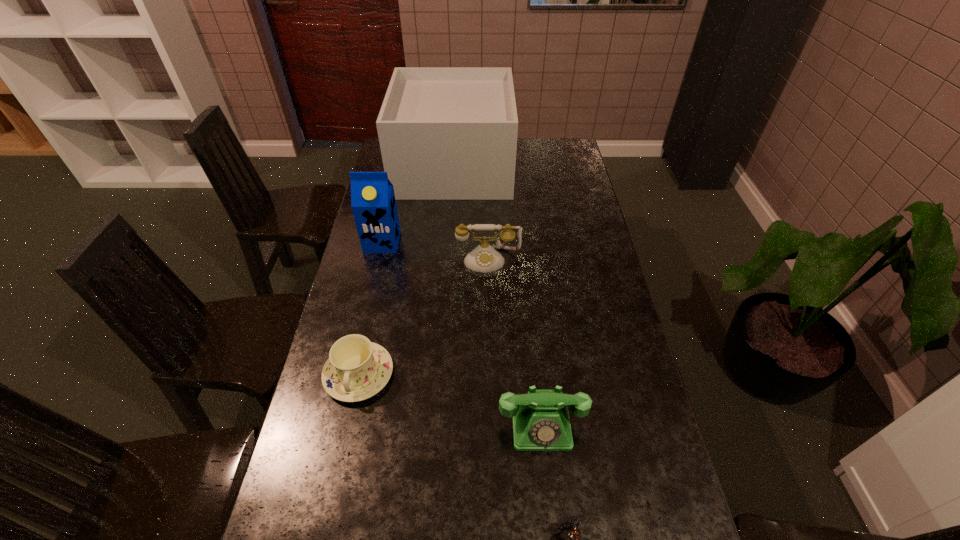
Image resolution: width=960 pixels, height=540 pixels. In order to click on vacant space that's between the second nearest telephone and the chinaware in this screenshot , I will do `click(450, 399)`.

This screenshot has height=540, width=960. Find the location of `vacant area that lies between the second nearest telephone and the farthest telephone`. vacant area that lies between the second nearest telephone and the farthest telephone is located at coordinates (515, 342).

At what (x,y) coordinates should I click in order to perform the action: click on empty location between the carton and the box. Please return your answer as a coordinate pair (x, y). The height and width of the screenshot is (540, 960). Looking at the image, I should click on (418, 204).

You are a GUI agent. You are given a task and a screenshot of the screen. Output one action in this format:
    pyautogui.click(x=<x>, y=<y>)
    Task: Click on the free spot between the farthest object and the carton
    The image size is (960, 540).
    Given the screenshot: What is the action you would take?
    pyautogui.click(x=418, y=204)

Identify which object is the fifth closest to the carton. Please provide its 2D coordinates. Your answer should be formatted as a tuple, i.e. [(x, y)], where the tuple contains the x and y coordinates of a point satisfying the conditions above.

[(574, 535)]

Point out which object is positioned as the fourth nearest to the second nearest telephone. Please provide its 2D coordinates. Your answer should be formatted as a tuple, i.e. [(x, y)], where the tuple contains the x and y coordinates of a point satisfying the conditions above.

[(373, 203)]

Select which telephone appears as the closest to the nearest object. Please provide its 2D coordinates. Your answer should be formatted as a tuple, i.e. [(x, y)], where the tuple contains the x and y coordinates of a point satisfying the conditions above.

[(541, 422)]

Locate an element on the screen. The width and height of the screenshot is (960, 540). telephone identified as the closest to the nearest object is located at coordinates (541, 422).

Locate an element on the screen. blank area in the image that satisfies the following two spatial constraints: 1. on the side of the farthest object with the window; 2. with the cap open on the carton is located at coordinates (448, 242).

Locate an element on the screen. vacant space that satisfies the following two spatial constraints: 1. on the side of the farthest object with the window; 2. with the cap open on the carton is located at coordinates (448, 242).